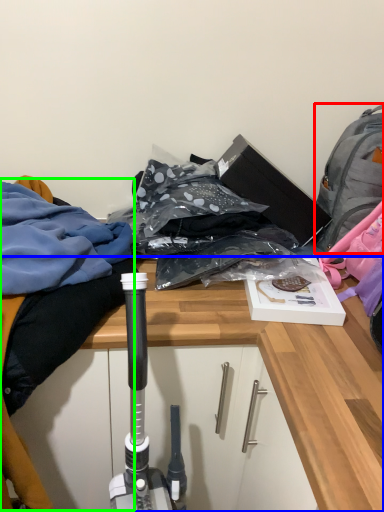
Question: Considering the real-world distances, which object is farthest from backpack (highlighted by a red box)? desk (highlighted by a blue box) or clothing (highlighted by a green box)?

Choices:
 (A) desk
 (B) clothing

Answer: (B)